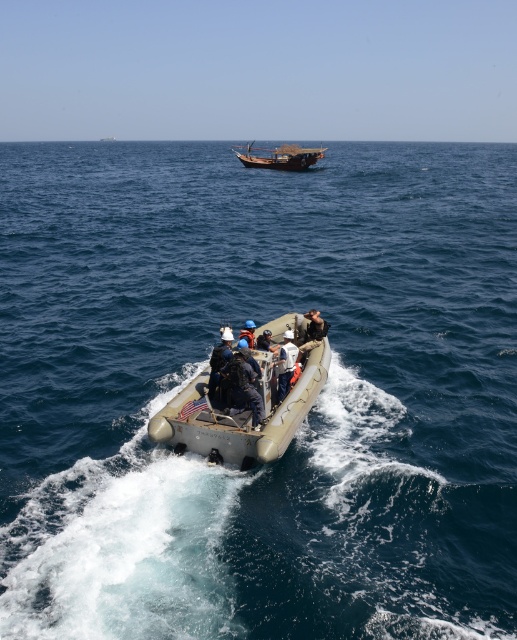
You are a passenger on the wooden sailboat at center and want to move to the light gray fabric jacket at center. Which direction should you go?

The wooden sailboat at center is to the left of light gray fabric jacket at center, so you should go to the right to reach the light gray fabric jacket at center.

You are a passenger on the beige rubber dinghy at center. You want to store your light gray fabric jacket at center in the dinghy. Is there enough space to fit the jacket inside the dinghy?

The beige rubber dinghy at center might be wider than the light gray fabric jacket at center, so there is likely enough space to store the jacket inside the dinghy.

You are standing on the deck of the inflatable boat and want to reach the point at coordinates point (226, 412). The inflatable boat is 20 feet long. Can you reach that point by moving forward from the boat?

The point at coordinates point (226, 412) is 34.34 feet away from the camera. Since the inflatable boat is only 20 feet long, you cannot reach that point by moving forward from the boat as the distance exceeds the boat length.